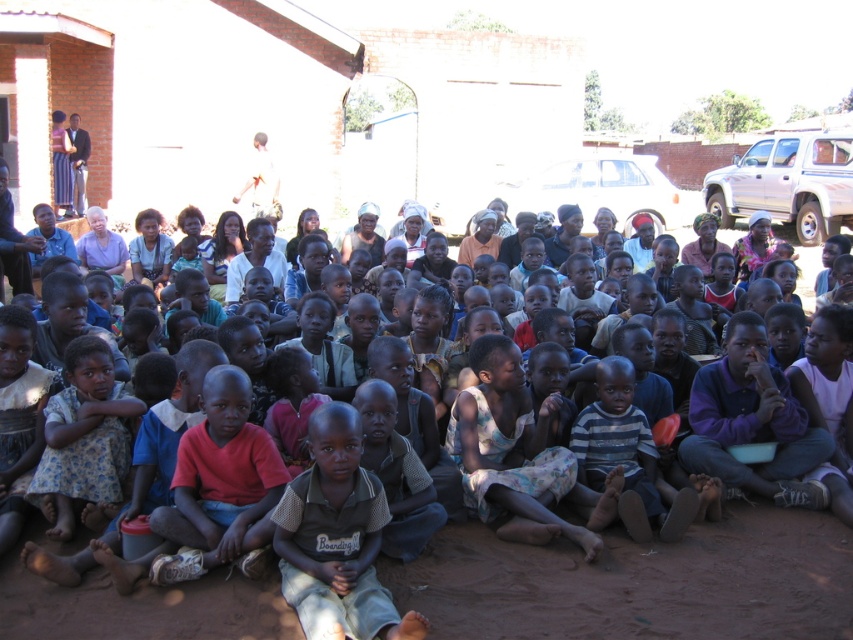
You are a photographer trying to capture a photo of the light brown woven shirt at center and the brown dirt field at center. Based on their positions, which object should you focus on first if you want both to be in the frame?

The light brown woven shirt at center is to the left of the brown dirt field at center, so you should focus on the light brown woven shirt at center first to ensure both are in the frame.